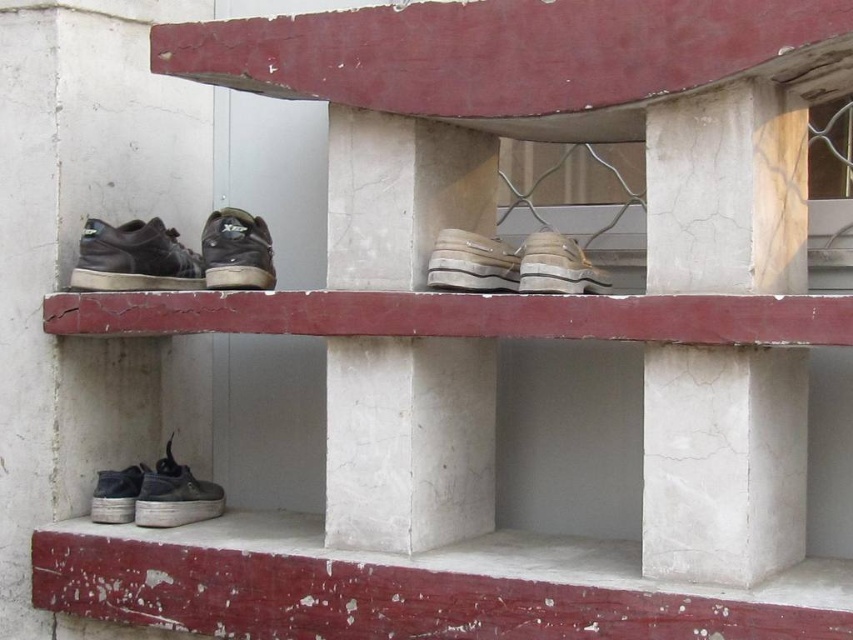
Question: Does cracked concrete ledge at center appear under white rubber shoe at center?

Choices:
 (A) yes
 (B) no

Answer: (A)

Question: Based on their relative distances, which object is farther from the shiny black shoe at lower left?

Choices:
 (A) white rubber shoe at center
 (B) worn leather shoe at center
 (C) dark gray suede shoe at lower left

Answer: (A)

Question: Which of these objects is positioned closest to the shiny black shoe at lower left?

Choices:
 (A) shiny black sneaker at center
 (B) cracked concrete ledge at center
 (C) worn leather shoe at center
 (D) matte black shoe at left

Answer: (D)

Question: Estimate the real-world distances between objects in this image. Which object is farther from the worn leather shoe at center?

Choices:
 (A) dark gray suede shoe at lower left
 (B) white rubber shoe at center
 (C) shiny black sneaker at center
 (D) matte black shoe at left

Answer: (A)

Question: Does cracked concrete ledge at center lie in front of worn leather shoe at center?

Choices:
 (A) yes
 (B) no

Answer: (A)

Question: Where is cracked concrete ledge at center located in relation to white rubber shoe at center in the image?

Choices:
 (A) above
 (B) below

Answer: (B)